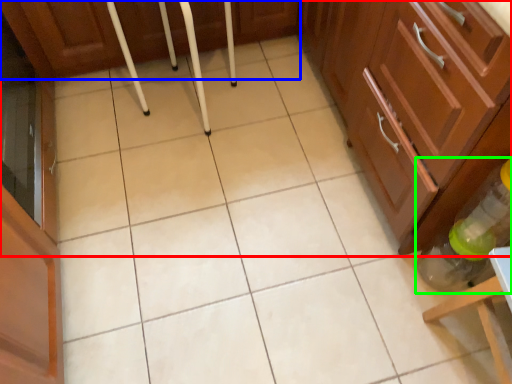
Question: Considering the real-world distances, which object is farthest from cabinetry (highlighted by a red box)? cabinetry (highlighted by a blue box) or bottle (highlighted by a green box)?

Choices:
 (A) cabinetry
 (B) bottle

Answer: (A)